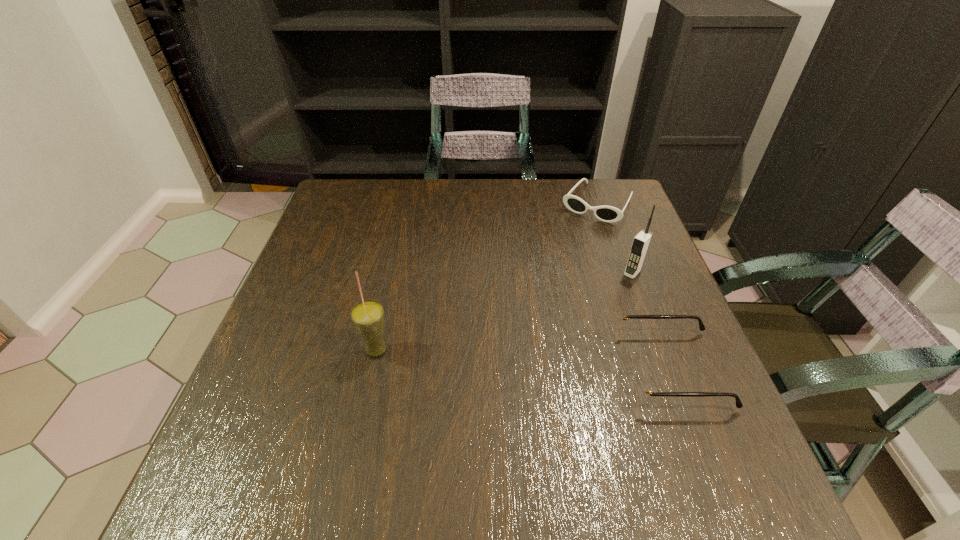
Find the location of a particular element. Image resolution: width=960 pixels, height=540 pixels. object that ranks as the closest to the sunglasses is located at coordinates click(x=641, y=242).

Where is `vacant position in the image that satisfies the following two spatial constraints: 1. on the front side of the spectacles; 2. at the hinge ends of the cellular telephone`? The height and width of the screenshot is (540, 960). vacant position in the image that satisfies the following two spatial constraints: 1. on the front side of the spectacles; 2. at the hinge ends of the cellular telephone is located at coordinates (668, 369).